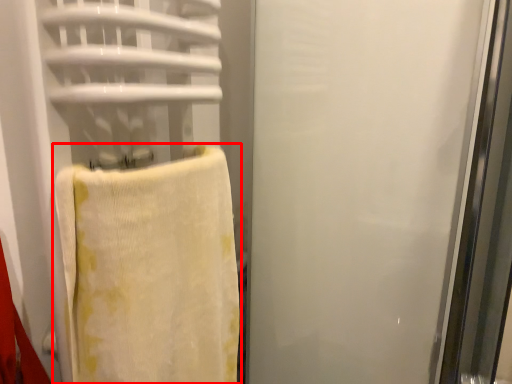
Question: From the image's perspective, where is towel (annotated by the red box) located in relation to screen door in the image?

Choices:
 (A) above
 (B) below

Answer: (B)